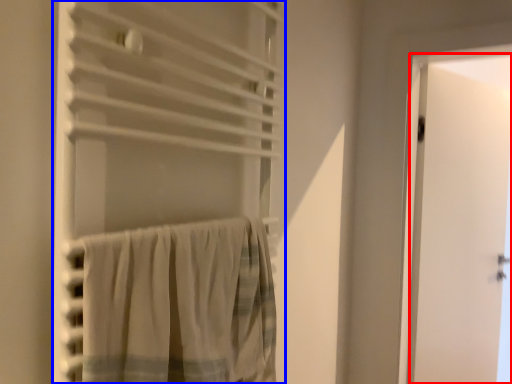
Question: Among these objects, which one is farthest to the camera, door (highlighted by a red box) or curtain (highlighted by a blue box)?

Choices:
 (A) door
 (B) curtain

Answer: (A)